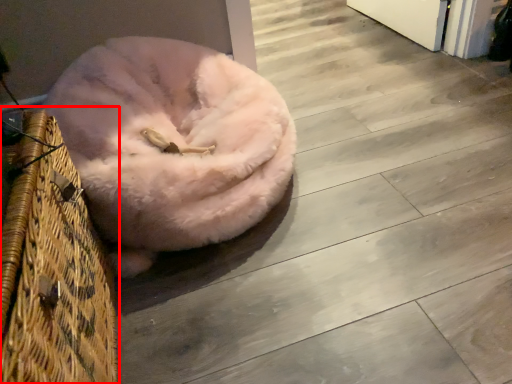
Question: From the image's perspective, what is the correct spatial positioning of basket (annotated by the red box) in reference to dog bed?

Choices:
 (A) below
 (B) above

Answer: (A)